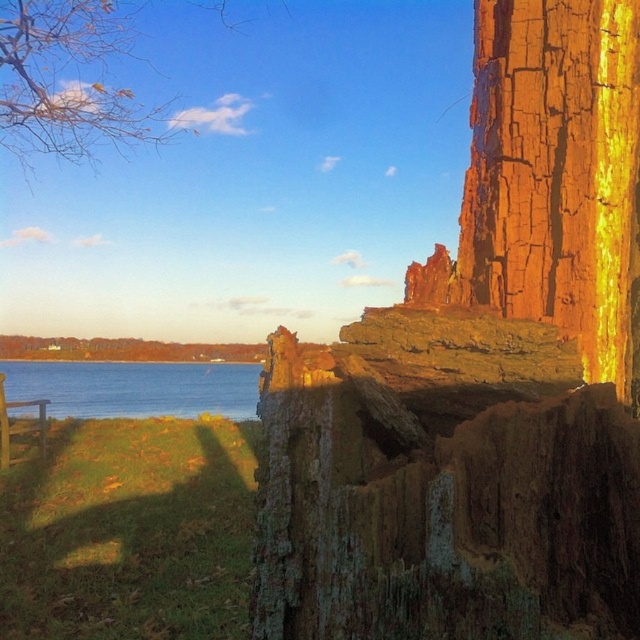
Does rusty metallic cliff at center have a smaller size compared to blue water at lower left?

No, rusty metallic cliff at center is not smaller than blue water at lower left.

Does point (506, 529) come behind point (259, 365)?

No, it is in front of (259, 365).

The height and width of the screenshot is (640, 640). What are the coordinates of `rusty metallic cliff at center` in the screenshot? It's located at (481, 380).

Which is behind, point (298, 588) or point (140, 1)?

Point (140, 1)

Does rusty metallic cliff at center have a greater height compared to yellow leafy branches at upper left?

Incorrect, rusty metallic cliff at center's height is not larger of yellow leafy branches at upper left's.

Measure the distance between point (502, 428) and camera.

They are 1.21 meters apart.

Find the location of `rusty metallic cliff at center`. rusty metallic cliff at center is located at coordinates (481, 380).

Between yellow leafy branches at upper left and blue water at lower left, which one has less height?

With less height is blue water at lower left.

Which is above, yellow leafy branches at upper left or blue water at lower left?

yellow leafy branches at upper left

Does point (10, 109) come closer to viewer compared to point (61, 385)?

Yes.

Locate an element on the screen. yellow leafy branches at upper left is located at coordinates (72, 81).